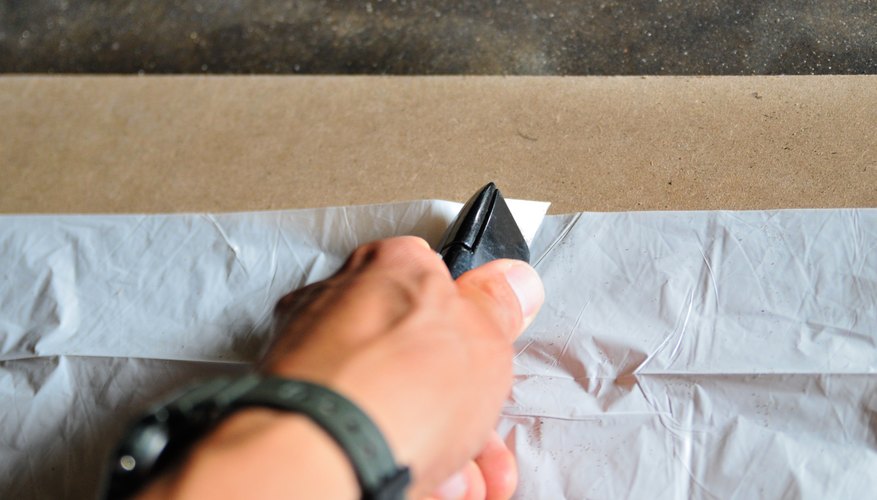
Identify the location of board. The width and height of the screenshot is (877, 500). (431, 140).